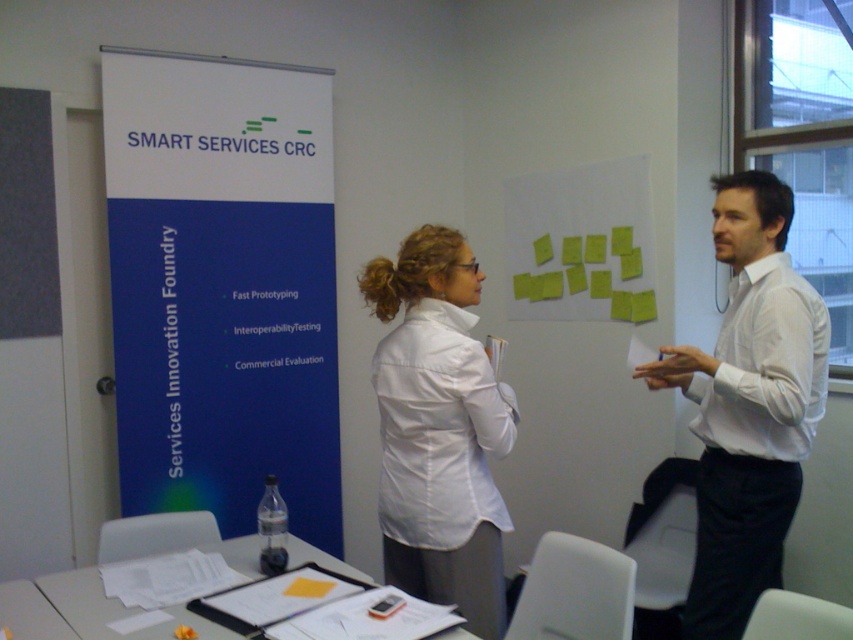
Which is in front, point (672, 348) or point (647, 275)?

Point (672, 348) is in front.

Who is taller, white shirt at right or yellow paper at upper center?

Standing taller between the two is white shirt at right.

The image size is (853, 640). Describe the element at coordinates (747, 404) in the screenshot. I see `white shirt at right` at that location.

You are a GUI agent. You are given a task and a screenshot of the screen. Output one action in this format:
    pyautogui.click(x=<x>, y=<y>)
    Task: Click on the white shirt at right
    This screenshot has height=640, width=853.
    Given the screenshot: What is the action you would take?
    pyautogui.click(x=747, y=404)

Image resolution: width=853 pixels, height=640 pixels. What do you see at coordinates (222, 288) in the screenshot?
I see `blue paperboard at center` at bounding box center [222, 288].

Does blue paperboard at center have a larger size compared to yellow paper at upper center?

Yes, blue paperboard at center is bigger than yellow paper at upper center.

Identify the location of blue paperboard at center. This screenshot has height=640, width=853. (222, 288).

Can you confirm if blue paperboard at center is positioned below white matte shirt at center?

Actually, blue paperboard at center is above white matte shirt at center.

Between blue paperboard at center and white matte shirt at center, which one has less height?

white matte shirt at center is shorter.

Is point (199, 358) positioned in front of point (439, 412)?

No, (199, 358) is behind (439, 412).

What are the coordinates of `blue paperboard at center` in the screenshot? It's located at (222, 288).